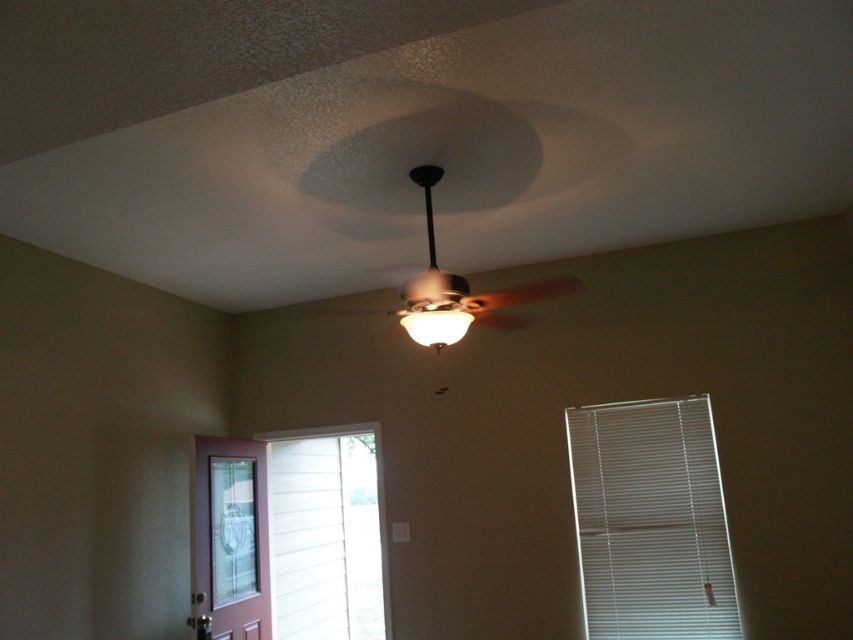
Which is behind, point (697, 401) or point (418, 314)?

Point (697, 401)

Does white plastic blinds at right have a larger size compared to matte white lamp at center?

Correct, white plastic blinds at right is larger in size than matte white lamp at center.

The image size is (853, 640). I want to click on white plastic blinds at right, so click(650, 522).

Can you confirm if metallic silver fan at center is positioned below matte white lamp at center?

Incorrect, metallic silver fan at center is not positioned below matte white lamp at center.

Consider the image. Can you confirm if metallic silver fan at center is positioned to the right of matte white lamp at center?

Indeed, metallic silver fan at center is positioned on the right side of matte white lamp at center.

Image resolution: width=853 pixels, height=640 pixels. Identify the location of metallic silver fan at center. (463, 276).

I want to click on metallic silver fan at center, so click(x=463, y=276).

Which is more to the left, white plastic blinds at right or metallic silver fan at center?

metallic silver fan at center is more to the left.

Is white plastic blinds at right positioned at the back of metallic silver fan at center?

Yes, it is behind metallic silver fan at center.

Identify the location of white plastic blinds at right. This screenshot has width=853, height=640. (650, 522).